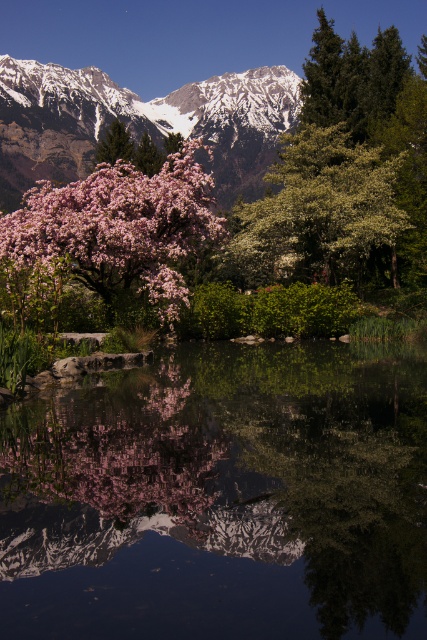
Question: Which point is farther to the camera?

Choices:
 (A) (149, 124)
 (B) (324, 584)
 (C) (295, 232)
 (D) (9, 252)

Answer: (A)

Question: Is transparent glass lake at center bigger than snowy rocky mountain range at upper left?

Choices:
 (A) yes
 (B) no

Answer: (B)

Question: Does pink blossoms at center appear under green leafy tree at center?

Choices:
 (A) yes
 (B) no

Answer: (B)

Question: Does transparent glass lake at center appear on the left side of green leafy tree at center?

Choices:
 (A) no
 (B) yes

Answer: (B)

Question: Which object appears closest to the camera in this image?

Choices:
 (A) transparent glass lake at center
 (B) pink blossoms at center

Answer: (A)

Question: Which object is positioned closest to the transparent glass lake at center?

Choices:
 (A) pink blossoms at center
 (B) snowy rocky mountain range at upper left
 (C) green leafy tree at center

Answer: (A)